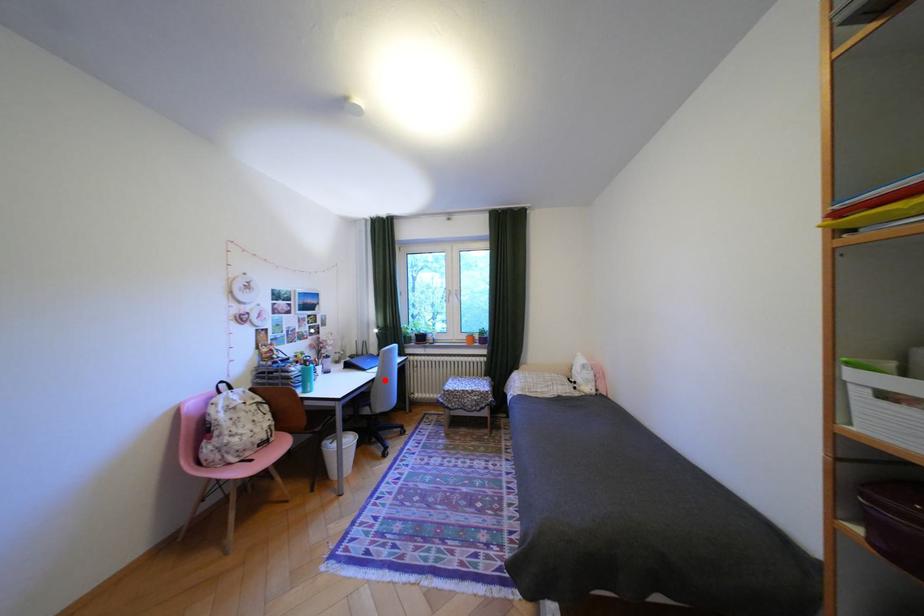
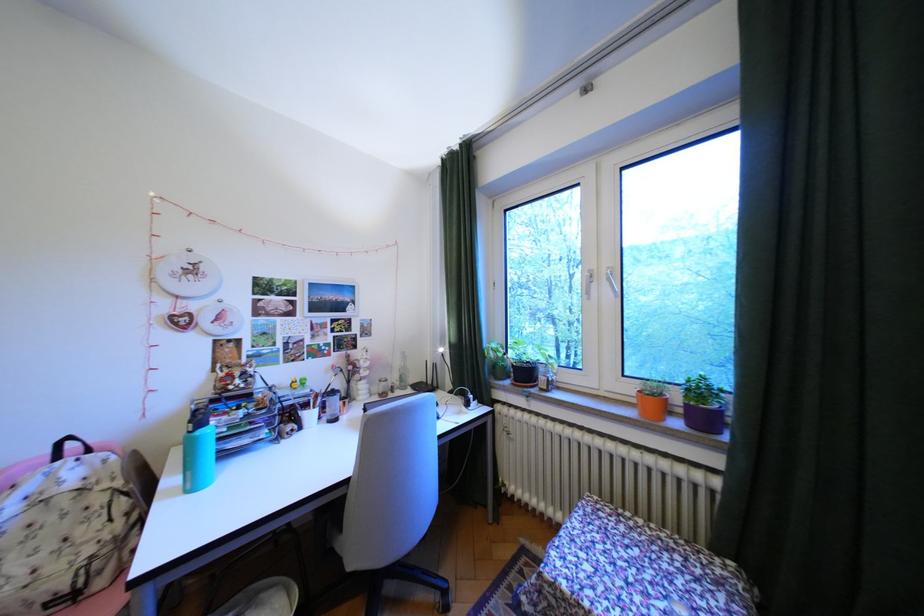
Question: A red point is marked in image1. In image2, is the corresponding 3D point closer to the camera or farther? Reply with the corresponding letter.

Choices:
 (A) The corresponding 3D point is closer.
 (B) The corresponding 3D point is farther.

Answer: (B)